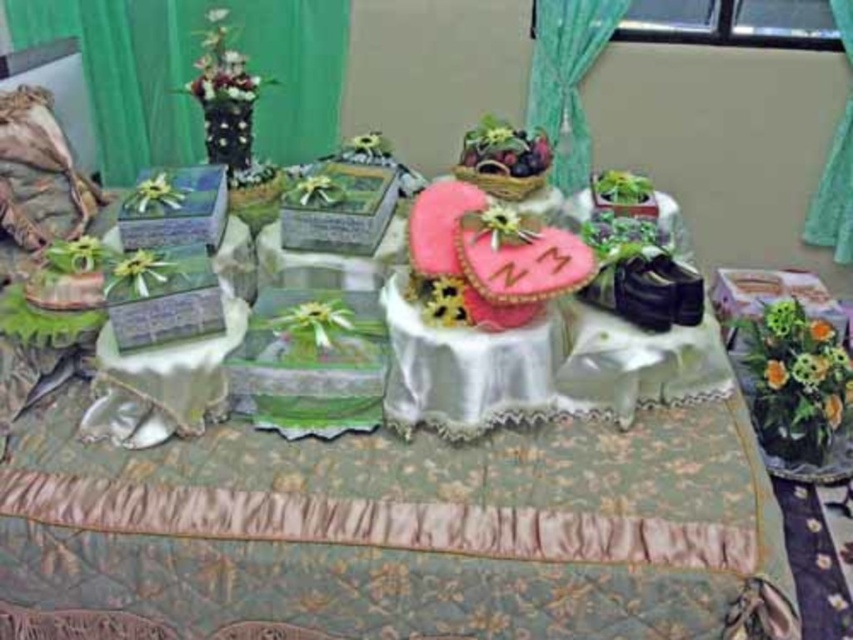
Question: Which object is positioned farthest from the green fabric curtain at upper left?

Choices:
 (A) green sheer curtain at upper right
 (B) green sheer curtain at upper center

Answer: (A)

Question: Which point is closer to the camera?

Choices:
 (A) green sheer curtain at upper right
 (B) green sheer curtain at upper center
 (C) green fabric curtain at upper left

Answer: (A)

Question: Among these points, which one is nearest to the camera?

Choices:
 (A) (561, 13)
 (B) (108, 141)
 (C) (843, 188)

Answer: (A)

Question: Is silky white tablecloth at center bigger than green sheer curtain at upper center?

Choices:
 (A) yes
 (B) no

Answer: (A)

Question: Is green fabric curtain at upper left bigger than green sheer curtain at upper center?

Choices:
 (A) yes
 (B) no

Answer: (A)

Question: Is the position of silky white tablecloth at center less distant than that of green sheer curtain at upper right?

Choices:
 (A) yes
 (B) no

Answer: (A)